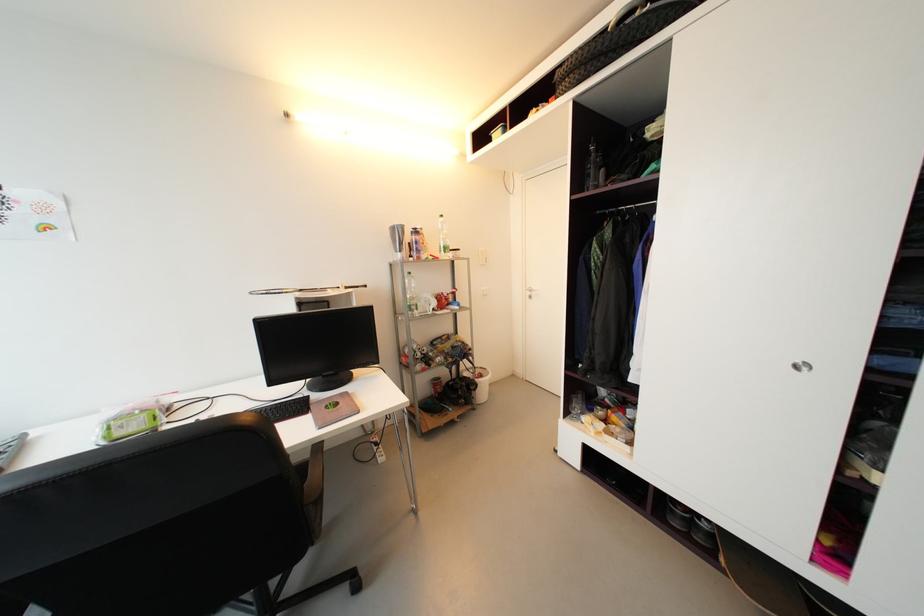
This screenshot has height=616, width=924. Identify the location of black keyboard. tap(285, 408).